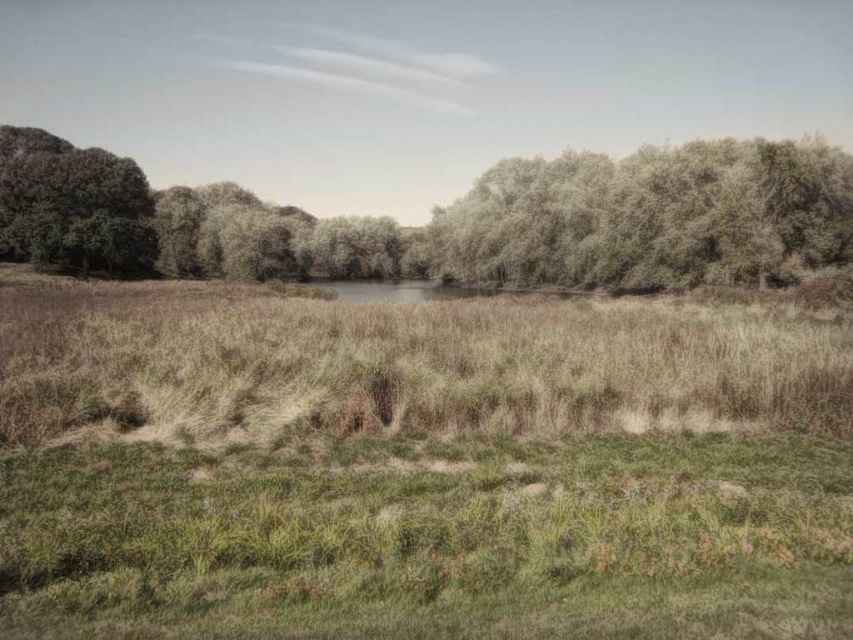
You are standing in the middle of the green grassy field at center and want to walk towards the green leafy trees at upper center. Which direction should you head?

You should head to the right because the green grassy field at center is to the left of the green leafy trees at upper center, so moving right would take you towards them.

You are standing in the middle of the green grassy field at center and want to take a photo of the green leafy tree at upper left. Which direction should you face to capture the tree in your view?

You should face the upper left direction to capture the green leafy tree at upper left in your view since it is located at the upper left of the scene.

You are standing in the green grassy field at center and want to walk towards the green leafy trees at upper center. Which direction should you move to get closer to the trees?

You should move forward because the green grassy field at center is in front of the green leafy trees at upper center, meaning the trees are behind you. Wait, this seems contradictory. Let me think again. If the grassy field is in front of the trees, then the trees are behind the field. So if you are on the field, the trees are ahead. Hmm, maybe the answer is to move forward towards the direction where the trees are located. Wait, the description says the field is in front of the trees, so the trees are in